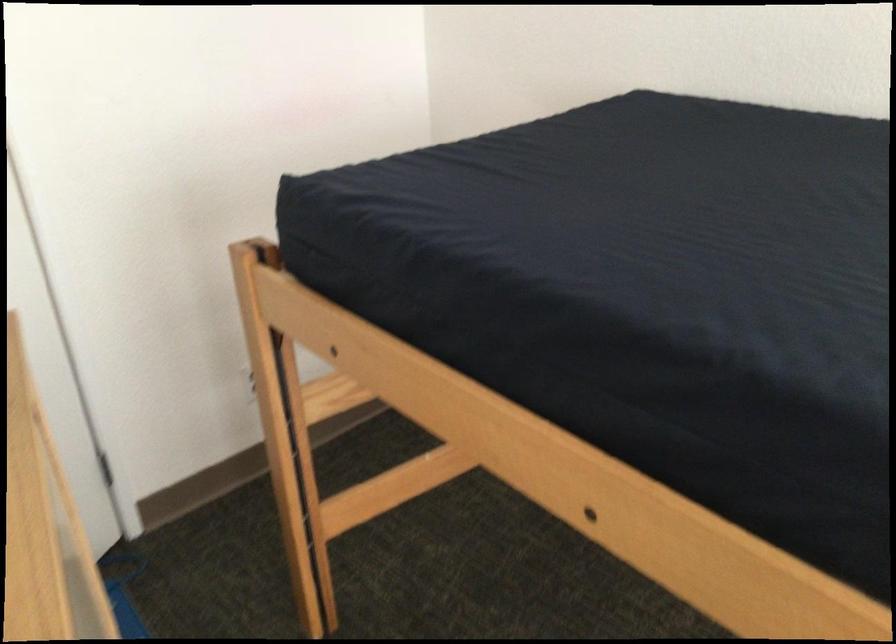
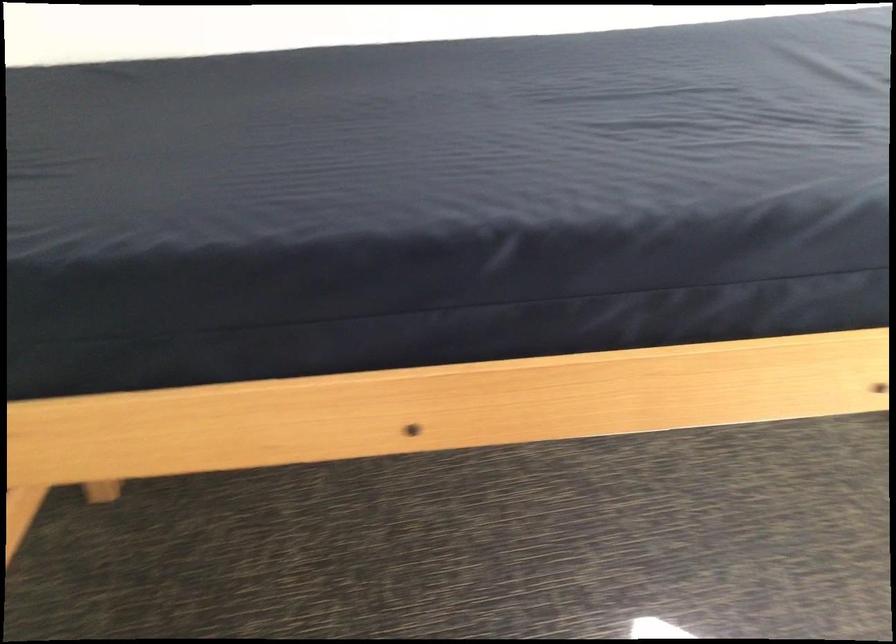
Find the pixel in the second image that matches the point at 521,333 in the first image.

(254, 308)